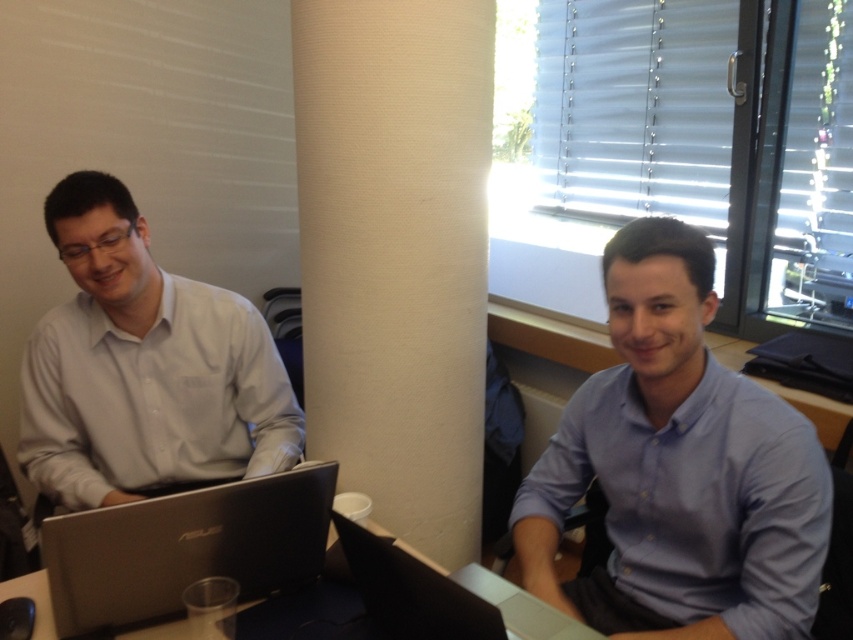
You are organizing a workspace and need to place both the silver metallic laptop at lower left and the silver metallic laptop at center on a shelf that can only hold items up to the size of the smaller laptop. Which laptop should you avoid placing on the shelf?

You should avoid placing the silver metallic laptop at lower left on the shelf because it is larger than the silver metallic laptop at center, and the shelf can only accommodate items up to the size of the smaller laptop.

You are an interior designer assessing the office layout. You need to place a new decorative item between the beige textured pillar at center and the matte white shirt at left. Based on their widths, which object should the item be placed closer to?

The beige textured pillar at center has a lesser width compared to the matte white shirt at left, so the decorative item should be placed closer to the beige textured pillar at center to balance the space.

You are organizing a meeting in the office and need to place a 15 cm wide notebook between the silver metallic laptop at lower left and the silver metallic laptop at center. Can you fit the notebook between them?

The silver metallic laptop at lower left is positioned on the left side of silver metallic laptop at center, so there is space between them. However, the exact distance isn not provided. If the gap between the two laptops is at least 15 cm wide, the notebook can fit. Please measure the space before placing the notebook.